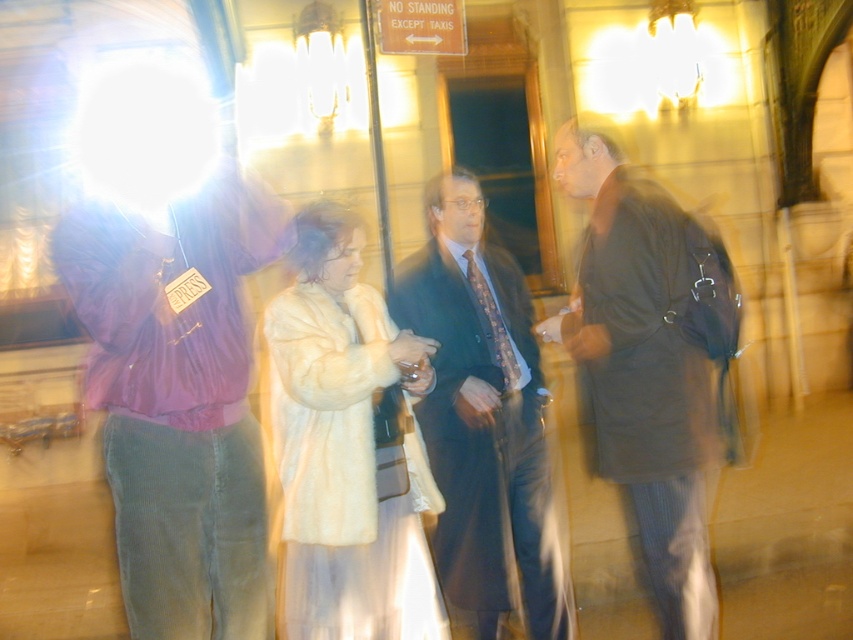
Does dark brown leather coat at center have a lesser width compared to dark suit at center?

Indeed, dark brown leather coat at center has a lesser width compared to dark suit at center.

Who is higher up, dark brown leather coat at center or dark suit at center?

Positioned higher is dark brown leather coat at center.

What do you see at coordinates (651, 365) in the screenshot?
I see `dark brown leather coat at center` at bounding box center [651, 365].

You are a GUI agent. You are given a task and a screenshot of the screen. Output one action in this format:
    pyautogui.click(x=<x>, y=<y>)
    Task: Click on the dark brown leather coat at center
    
    Given the screenshot: What is the action you would take?
    pyautogui.click(x=651, y=365)

Between purple corduroy jacket at left and dark brown leather coat at center, which one is positioned lower?

dark brown leather coat at center is lower down.

Is point (235, 202) less distant than point (624, 248)?

Yes, point (235, 202) is closer to viewer.

Is point (199, 314) closer to camera compared to point (634, 444)?

Yes.

Locate an element on the screen. Image resolution: width=853 pixels, height=640 pixels. purple corduroy jacket at left is located at coordinates (173, 355).

Which of these two, purple corduroy jacket at left or dark suit at center, stands taller?

Standing taller between the two is dark suit at center.

Does purple corduroy jacket at left appear under dark suit at center?

Incorrect, purple corduroy jacket at left is not positioned below dark suit at center.

Is point (262, 608) positioned before point (467, 240)?

That is True.

This screenshot has width=853, height=640. Identify the location of purple corduroy jacket at left. [173, 355].